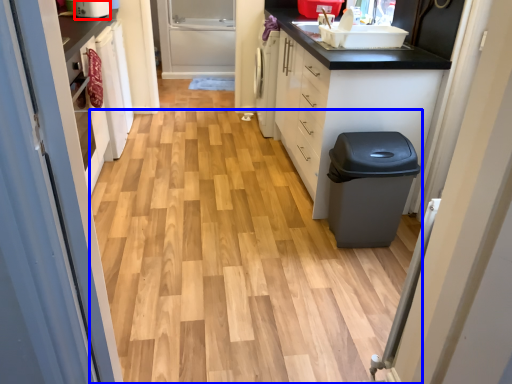
Question: Which point is further to the camera, appliance (highlighted by a red box) or plain (highlighted by a blue box)?

Choices:
 (A) appliance
 (B) plain

Answer: (A)